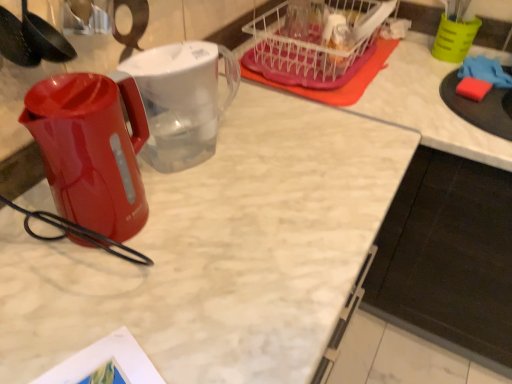
Question: Can you confirm if black matte cabinet at lower right is positioned to the right of glossy plastic kettle at left?

Choices:
 (A) no
 (B) yes

Answer: (B)

Question: Can you confirm if black matte cabinet at lower right is bigger than glossy plastic kettle at left?

Choices:
 (A) yes
 (B) no

Answer: (A)

Question: Is black matte cabinet at lower right facing away from glossy plastic kettle at left?

Choices:
 (A) no
 (B) yes

Answer: (A)

Question: Can you confirm if black matte cabinet at lower right is shorter than glossy plastic kettle at left?

Choices:
 (A) no
 (B) yes

Answer: (A)

Question: Is black matte cabinet at lower right closer to camera compared to glossy plastic kettle at left?

Choices:
 (A) yes
 (B) no

Answer: (B)

Question: In terms of height, does black plastic spoon at upper left look taller or shorter compared to glossy plastic kettle at left?

Choices:
 (A) tall
 (B) short

Answer: (A)

Question: From a real-world perspective, is black plastic spoon at upper left positioned above or below glossy plastic kettle at left?

Choices:
 (A) below
 (B) above

Answer: (B)

Question: Is point (60, 61) positioned closer to the camera than point (104, 205)?

Choices:
 (A) closer
 (B) farther

Answer: (B)

Question: Looking at their shapes, would you say black plastic spoon at upper left is wider or thinner than glossy plastic kettle at left?

Choices:
 (A) wide
 (B) thin

Answer: (B)

Question: From their relative heights in the image, would you say black matte cabinet at lower right is taller or shorter than black plastic spoon at upper left?

Choices:
 (A) short
 (B) tall

Answer: (B)

Question: From a real-world perspective, is black matte cabinet at lower right positioned above or below black plastic spoon at upper left?

Choices:
 (A) above
 (B) below

Answer: (B)

Question: Is black matte cabinet at lower right wider or thinner than black plastic spoon at upper left?

Choices:
 (A) wide
 (B) thin

Answer: (A)

Question: Considering their positions, is black matte cabinet at lower right located in front of or behind black plastic spoon at upper left?

Choices:
 (A) behind
 (B) front

Answer: (A)

Question: Is black plastic spoon at upper left bigger or smaller than transparent plastic pitcher at center?

Choices:
 (A) small
 (B) big

Answer: (A)

Question: From the image's perspective, is black plastic spoon at upper left positioned above or below transparent plastic pitcher at center?

Choices:
 (A) below
 (B) above

Answer: (B)